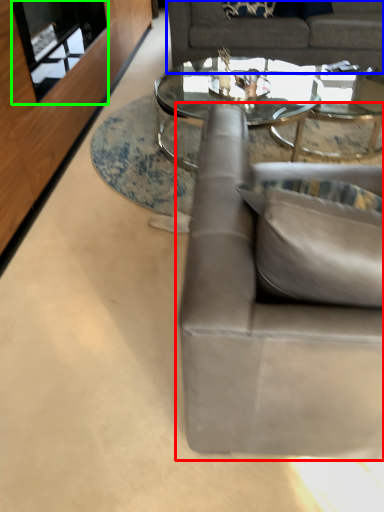
Question: Considering the real-world distances, which object is farthest from studio couch (highlighted by a red box)? studio couch (highlighted by a blue box) or glass door (highlighted by a green box)?

Choices:
 (A) studio couch
 (B) glass door

Answer: (A)